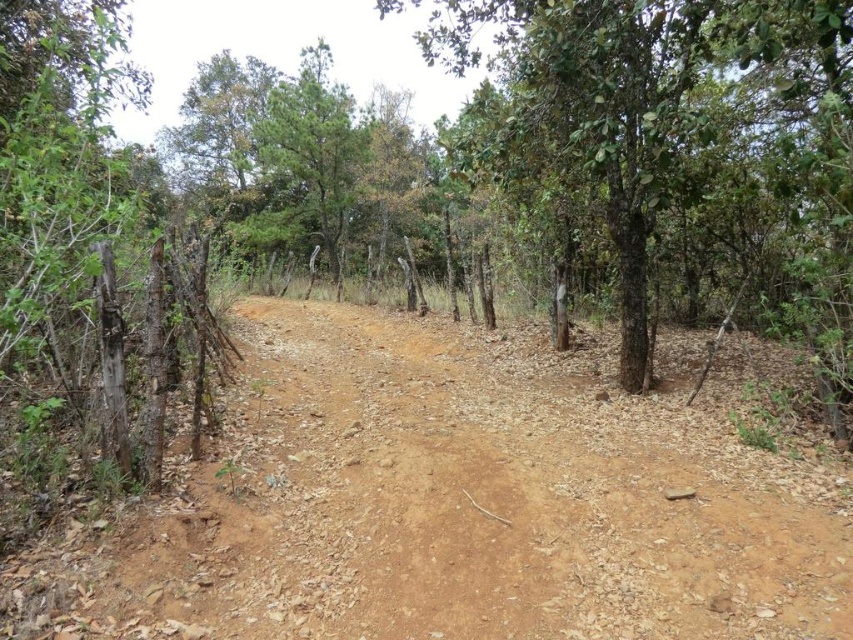
Can you confirm if brown dirt track at center is positioned to the right of green rough bark tree at center?

In fact, brown dirt track at center is to the left of green rough bark tree at center.

Can you confirm if brown dirt track at center is positioned above green rough bark tree at center?

Actually, brown dirt track at center is below green rough bark tree at center.

The height and width of the screenshot is (640, 853). Describe the element at coordinates (460, 502) in the screenshot. I see `brown dirt track at center` at that location.

This screenshot has height=640, width=853. In order to click on brown dirt track at center in this screenshot , I will do `click(460, 502)`.